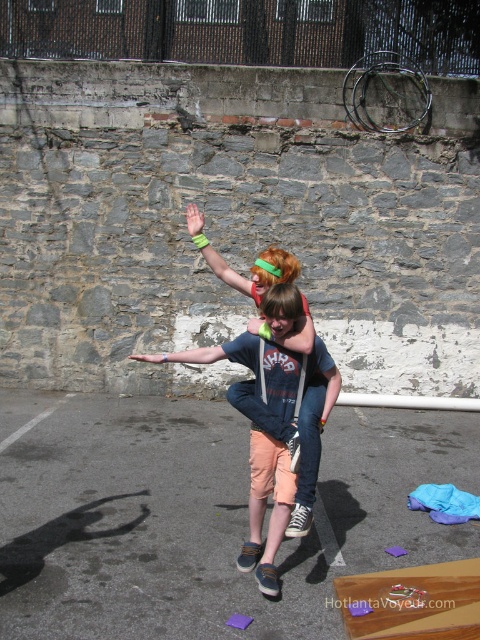
Is the position of denim shorts at center more distant than that of matte blue jeans at center?

That is False.

Can you confirm if denim shorts at center is bigger than matte blue jeans at center?

Indeed, denim shorts at center has a larger size compared to matte blue jeans at center.

I want to click on denim shorts at center, so click(x=290, y=438).

Is denim shorts at center further to the viewer compared to green rubber wristband at upper center?

No.

Does point (260, 332) lie in front of point (224, 275)?

Yes, point (260, 332) is closer to viewer.

Which is behind, point (301, 296) or point (206, 253)?

Positioned behind is point (206, 253).

Image resolution: width=480 pixels, height=640 pixels. In order to click on denim shorts at center in this screenshot , I will do `click(290, 438)`.

Who is positioned more to the left, denim shorts at center or smooth skin hand at center?

From the viewer's perspective, smooth skin hand at center appears more on the left side.

Is denim shorts at center below smooth skin hand at center?

No.

Is point (305, 300) behind point (130, 358)?

No, (305, 300) is in front of (130, 358).

In order to click on denim shorts at center in this screenshot , I will do (290, 438).